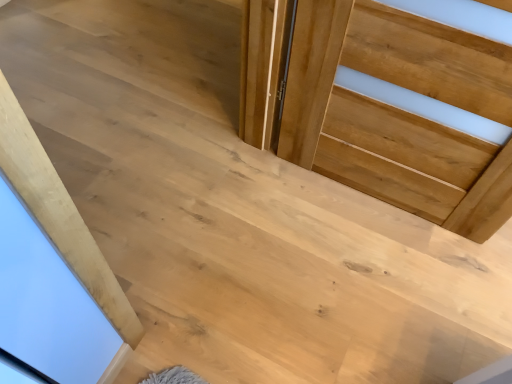
You are a GUI agent. You are given a task and a screenshot of the screen. Output one action in this format:
    pyautogui.click(x=<x>, y=<y>)
    Task: Click on the vacant space underneath natural wood chest of drawers at right (from a real-world perspective)
    
    Given the screenshot: What is the action you would take?
    pyautogui.click(x=376, y=204)